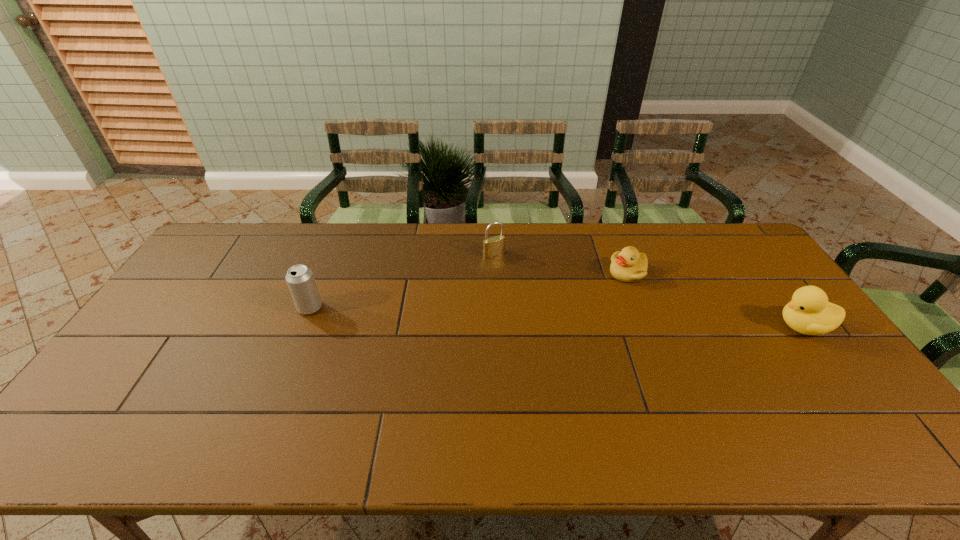
Find the location of `free space between the beer can and the farthest object`. free space between the beer can and the farthest object is located at coordinates (402, 281).

Where is `vacant space in between the padlock and the leftmost object`? The height and width of the screenshot is (540, 960). vacant space in between the padlock and the leftmost object is located at coordinates (402, 281).

This screenshot has width=960, height=540. In order to click on free spot between the farthest object and the rightmost object in this screenshot , I will do `click(649, 291)`.

This screenshot has height=540, width=960. Find the location of `free spot between the beer can and the third object from left to right`. free spot between the beer can and the third object from left to right is located at coordinates (468, 290).

Image resolution: width=960 pixels, height=540 pixels. In order to click on free space between the duckling and the second object from left to right in this screenshot , I will do `click(561, 264)`.

Locate an element on the screen. The image size is (960, 540). object that stands as the third closest to the rightmost object is located at coordinates (300, 279).

Identify which object is located as the third nearest to the second farthest object. Please provide its 2D coordinates. Your answer should be formatted as a tuple, i.e. [(x, y)], where the tuple contains the x and y coordinates of a point satisfying the conditions above.

[(300, 279)]

Where is `free location that satisfies the following two spatial constraints: 1. on the front side of the beer can; 2. on the front-facing side of the rightmost object`? This screenshot has height=540, width=960. free location that satisfies the following two spatial constraints: 1. on the front side of the beer can; 2. on the front-facing side of the rightmost object is located at coordinates point(302,327).

Identify the location of vacant region that satisfies the following two spatial constraints: 1. on the front side of the rightmost object; 2. on the front-facing side of the beer can. (302, 327).

The image size is (960, 540). What are the coordinates of `blank space that satisfies the following two spatial constraints: 1. on the front side of the leftmost object; 2. on the front-facing side of the rightmost object` in the screenshot? It's located at (302, 327).